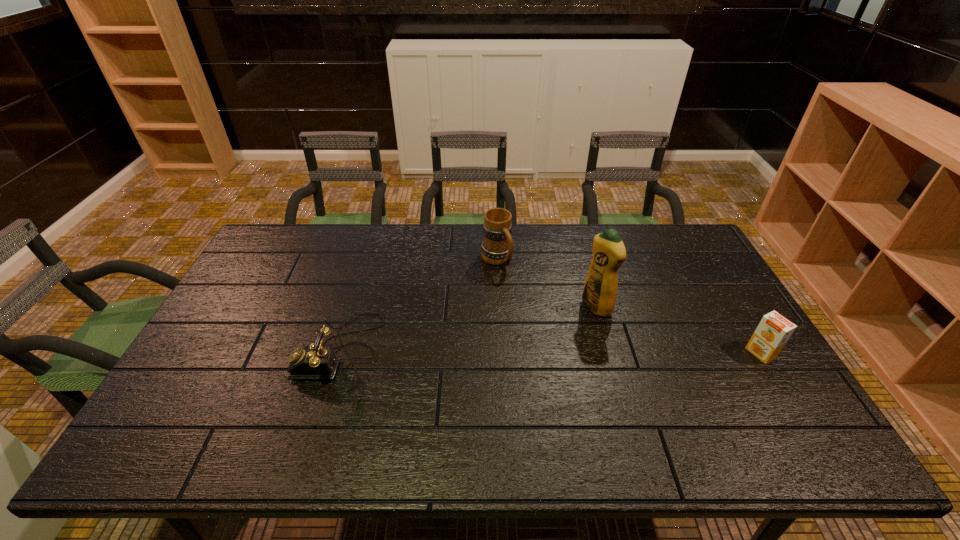
The height and width of the screenshot is (540, 960). Identify the location of unoccupied area between the orange juice and the detergent. point(678,330).

At what (x,y) coordinates should I click in order to perform the action: click on vacant area that lies between the third object from left to right and the orange juice. Please return your answer as a coordinate pair (x, y). Looking at the image, I should click on (678, 330).

Locate an element on the screen. Image resolution: width=960 pixels, height=540 pixels. free spot between the rightmost object and the tallest object is located at coordinates (678, 330).

I want to click on free point between the detergent and the telephone, so click(x=468, y=328).

The image size is (960, 540). I want to click on free spot between the mug and the detergent, so click(546, 283).

Locate which object ranks in proximity to the mug. Please provide its 2D coordinates. Your answer should be formatted as a tuple, i.e. [(x, y)], where the tuple contains the x and y coordinates of a point satisfying the conditions above.

[(599, 294)]

Where is `object that stands as the third closest to the orange juice`? The image size is (960, 540). object that stands as the third closest to the orange juice is located at coordinates (317, 361).

Locate an element on the screen. The height and width of the screenshot is (540, 960). blank area in the image that satisfies the following two spatial constraints: 1. on the front side of the farthest object; 2. on the right side of the orange juice is located at coordinates (501, 353).

Find the location of a particular element. vacant space that satisfies the following two spatial constraints: 1. on the front side of the orange juice; 2. on the right side of the tallest object is located at coordinates (609, 353).